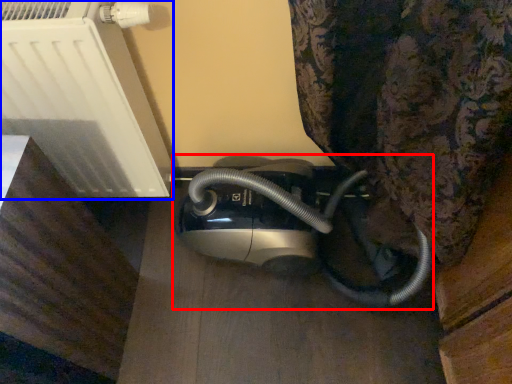
Question: Which object is further to the camera taking this photo, home appliance (highlighted by a red box) or appliance (highlighted by a blue box)?

Choices:
 (A) home appliance
 (B) appliance

Answer: (A)